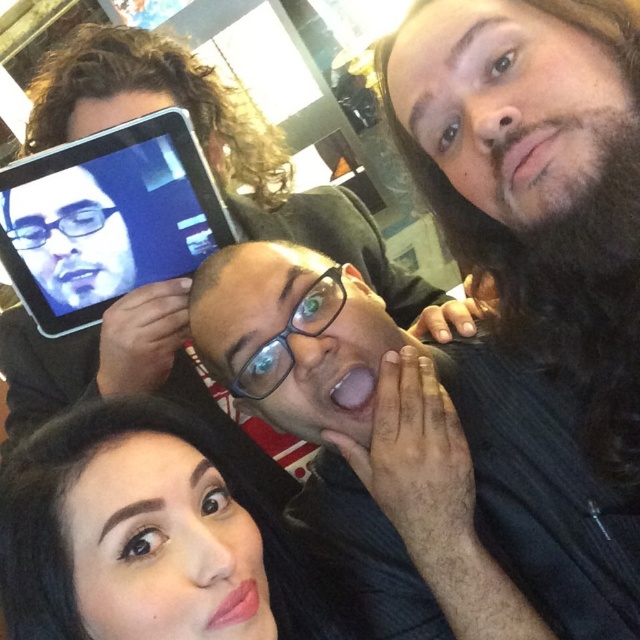
Does shiny black hair at lower left have a greater height compared to black plastic tablet at upper left?

Incorrect, shiny black hair at lower left's height is not larger of black plastic tablet at upper left's.

Between point (227, 570) and point (192, 182), which one is positioned behind?

Positioned behind is point (192, 182).

Is point (180, 480) closer to camera compared to point (205, 204)?

Yes, it is in front of point (205, 204).

Locate an element on the screen. shiny black hair at lower left is located at coordinates (125, 528).